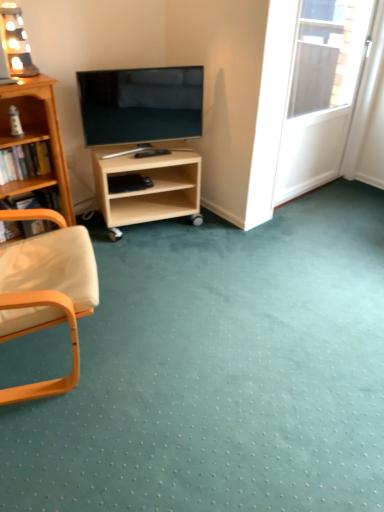
The width and height of the screenshot is (384, 512). What are the coordinates of `vacant area that lies in front of light wood/unfinishedobject at center` in the screenshot? It's located at (163, 258).